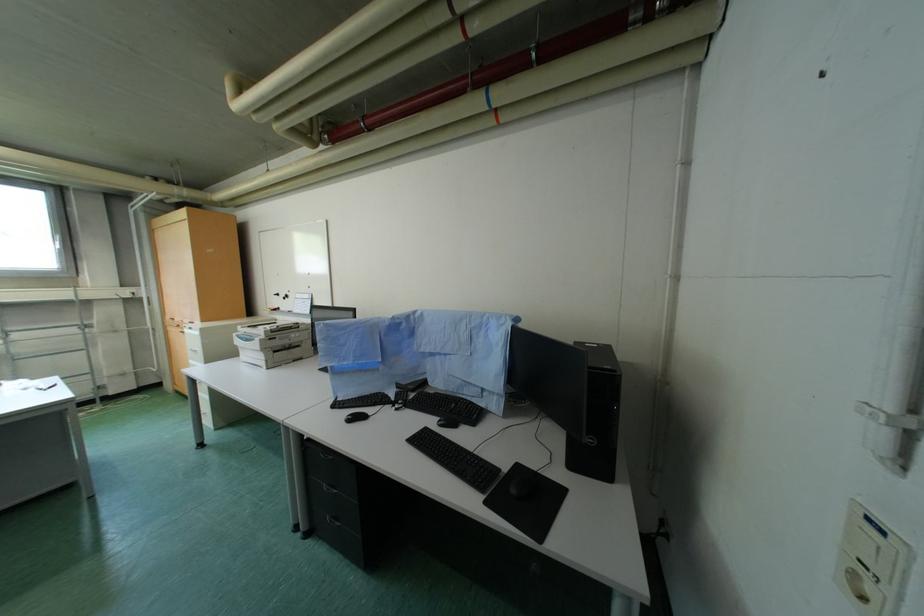
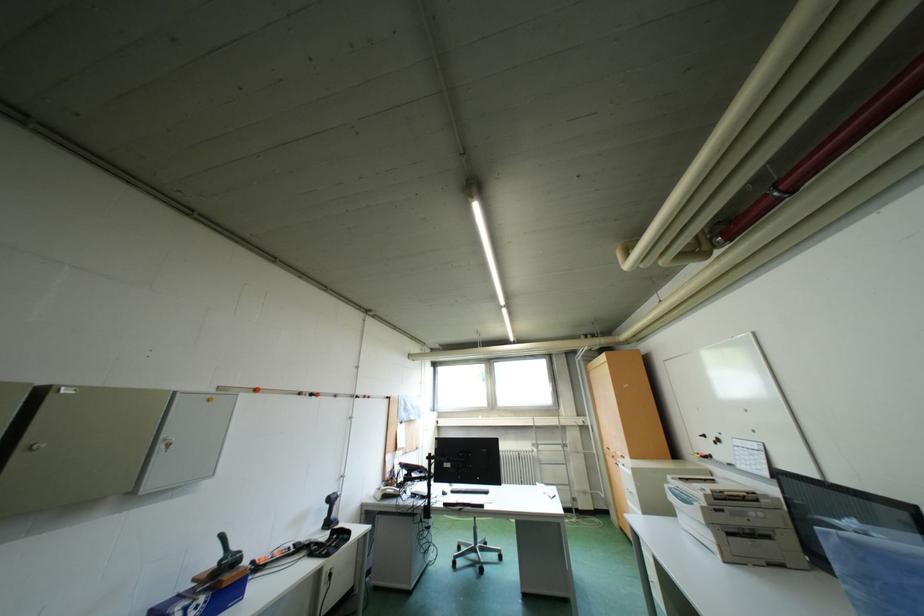
Consider the image. How did the camera likely rotate?

The camera rotated toward left-up.